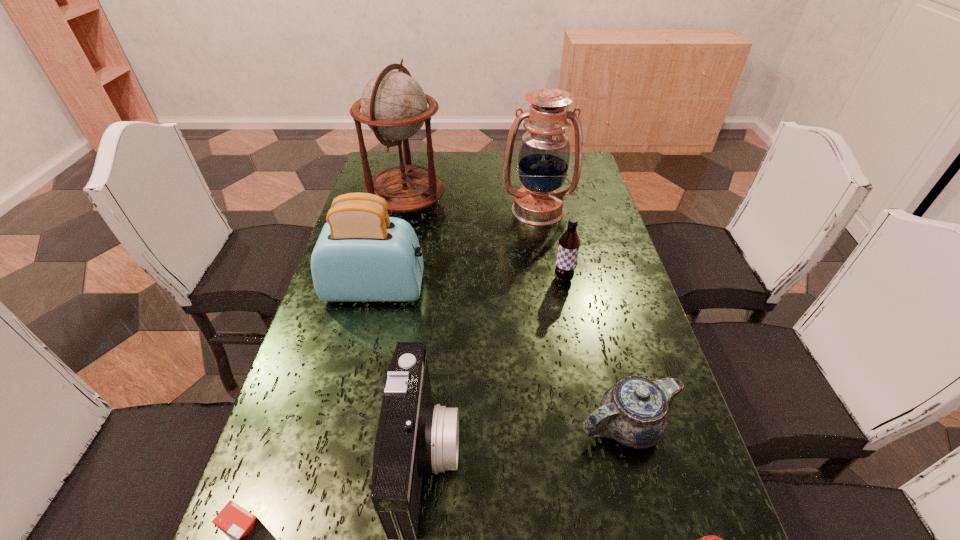
I want to click on blank space located from the spout of the chinaware, so click(483, 426).

This screenshot has width=960, height=540. What are the coordinates of `vacant space located from the spout of the chinaware` in the screenshot? It's located at (415, 426).

You are a GUI agent. You are given a task and a screenshot of the screen. Output one action in this format:
    pyautogui.click(x=<x>, y=<y>)
    Task: Click on the object at the far edge
    The height and width of the screenshot is (540, 960).
    Given the screenshot: What is the action you would take?
    pyautogui.click(x=394, y=106)

Image resolution: width=960 pixels, height=540 pixels. What are the coordinates of `globe that is at the left edge` in the screenshot? It's located at (394, 106).

This screenshot has height=540, width=960. Identify the location of toaster located at the left edge. [x=362, y=255].

Locate an element on the screen. oil lamp that is at the right edge is located at coordinates (544, 155).

Where is `root beer located at the right edge`? Image resolution: width=960 pixels, height=540 pixels. root beer located at the right edge is located at coordinates (569, 243).

You are a GUI agent. You are given a task and a screenshot of the screen. Output one action in this format:
    pyautogui.click(x=<x>, y=<y>)
    Task: Click on the chinaware present at the right edge
    This screenshot has height=540, width=960.
    Given the screenshot: What is the action you would take?
    pyautogui.click(x=634, y=412)

In order to click on object that is positioned at the far left corner in this screenshot , I will do `click(394, 106)`.

Identify the location of vacant region at the right edge of the desktop. (584, 272).